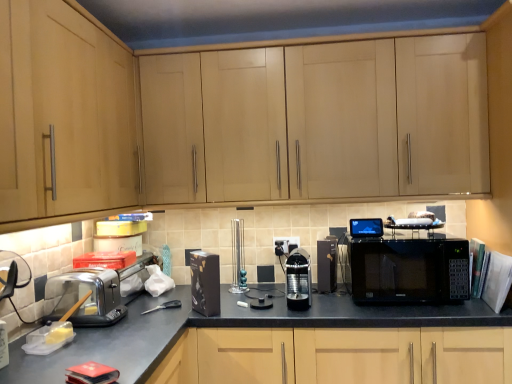
This screenshot has width=512, height=384. Describe the element at coordinates (327, 265) in the screenshot. I see `black plastic coffee machine at center, placed as the fourth appliance when sorted from left to right` at that location.

In order to face clear plastic toaster at lower left, should I rotate leftwards or rightwards?

Turn left approximately 21.924 degrees to face it.

What is the approximate width of sleek black coffee machine at center, which is the third appliance in left-to-right order?

It is 10.96 inches.

Describe the element at coordinates (298, 280) in the screenshot. This screenshot has height=384, width=512. I see `sleek black coffee machine at center, the 2th appliance positioned from the right` at that location.

Describe the element at coordinates (408, 270) in the screenshot. This screenshot has width=512, height=384. I see `black glossy microwave at center` at that location.

What are the coordinates of `light wood cabinet at upper center, acting as the first cabinetry starting from the back` in the screenshot? It's located at (318, 121).

How much space does black matte box at center, marked as the 1th appliance in a left-to-right arrangement, occupy horizontally?

The width of black matte box at center, marked as the 1th appliance in a left-to-right arrangement, is 16.67 centimeters.

You are a GUI agent. You are given a task and a screenshot of the screen. Output one action in this format:
    pyautogui.click(x=<x>, y=<y>)
    Task: Click on the black plastic electric outlet at center
    
    Given the screenshot: What is the action you would take?
    pyautogui.click(x=286, y=244)

This screenshot has height=384, width=512. In order to click on black plastic coffee machine at center, which appears as the 1th appliance when viewed from the right in this screenshot , I will do `click(327, 265)`.

Based on the photo, which object is positioned more to the left, light wood cabinet at left, which is the second cabinetry in back-to-front order, or black glossy microwave at center?

From the viewer's perspective, light wood cabinet at left, which is the second cabinetry in back-to-front order, appears more on the left side.

Which point is more distant from viewer, (56, 213) or (435, 270)?

The point (435, 270) is farther.

Based on the photo, between light wood cabinet at left, acting as the second cabinetry starting from the right, and black glossy microwave at center, which one has less height?

black glossy microwave at center.

From the image's perspective, is light wood cabinet at left, acting as the second cabinetry starting from the right, below black glossy microwave at center?

No, from the image's perspective, light wood cabinet at left, acting as the second cabinetry starting from the right, is not beneath black glossy microwave at center.

From a real-world perspective, between black plastic coffee machine at center, placed as the fourth appliance when sorted from left to right, and metallic teal candlesticks at center, positioned as the third appliance in right-to-left order, who is vertically higher?

metallic teal candlesticks at center, positioned as the third appliance in right-to-left order.

Is black plastic coffee machine at center, which appears as the 1th appliance when viewed from the right, not within metallic teal candlesticks at center, positioned as the third appliance in right-to-left order?

Absolutely, black plastic coffee machine at center, which appears as the 1th appliance when viewed from the right, is external to metallic teal candlesticks at center, positioned as the third appliance in right-to-left order.

Looking at their sizes, would you say black plastic coffee machine at center, placed as the fourth appliance when sorted from left to right, is wider or thinner than metallic teal candlesticks at center, positioned as the third appliance in right-to-left order?

black plastic coffee machine at center, placed as the fourth appliance when sorted from left to right, is wider than metallic teal candlesticks at center, positioned as the third appliance in right-to-left order.

Which of these two, black matte box at center, the fourth appliance from the right, or metallic teal candlesticks at center, positioned as the third appliance in right-to-left order, is smaller?

metallic teal candlesticks at center, positioned as the third appliance in right-to-left order.

Based on the photo, from the image's perspective, which one is positioned higher, black matte box at center, marked as the 1th appliance in a left-to-right arrangement, or metallic teal candlesticks at center, positioned as the third appliance in right-to-left order?

metallic teal candlesticks at center, positioned as the third appliance in right-to-left order, from the image's perspective.

How many degrees apart are the facing directions of black matte box at center, the fourth appliance from the right, and metallic teal candlesticks at center, positioned as the third appliance in right-to-left order?

black matte box at center, the fourth appliance from the right, and metallic teal candlesticks at center, positioned as the third appliance in right-to-left order, are facing 39.8 degrees away from each other.

Considering the sizes of black matte box at center, the fourth appliance from the right, and metallic teal candlesticks at center, arranged as the 2th appliance when viewed from the left, in the image, is black matte box at center, the fourth appliance from the right, taller or shorter than metallic teal candlesticks at center, arranged as the 2th appliance when viewed from the left,?

Considering their sizes, black matte box at center, the fourth appliance from the right, has less height than metallic teal candlesticks at center, arranged as the 2th appliance when viewed from the left.

Does metallic teal candlesticks at center, arranged as the 2th appliance when viewed from the left, turn towards black glossy microwave at center?

No, metallic teal candlesticks at center, arranged as the 2th appliance when viewed from the left, does not turn towards black glossy microwave at center.

Does point (236, 258) appear closer or farther from the camera than point (424, 255)?

Point (236, 258) is positioned farther from the camera compared to point (424, 255).

Considering the sizes of objects metallic teal candlesticks at center, arranged as the 2th appliance when viewed from the left, and black glossy microwave at center in the image provided, who is taller, metallic teal candlesticks at center, arranged as the 2th appliance when viewed from the left, or black glossy microwave at center?

metallic teal candlesticks at center, arranged as the 2th appliance when viewed from the left, is taller.

How many degrees apart are the facing directions of metallic teal candlesticks at center, arranged as the 2th appliance when viewed from the left, and black glossy microwave at center?

metallic teal candlesticks at center, arranged as the 2th appliance when viewed from the left, and black glossy microwave at center are facing 0.00051 degrees away from each other.

Are black plastic electric outlet at center and clear plastic toaster at lower left located far from each other?

No, black plastic electric outlet at center is not far from clear plastic toaster at lower left.

Consider the image. From a real-world perspective, is black plastic electric outlet at center physically located above or below clear plastic toaster at lower left?

In terms of real-world spatial position, black plastic electric outlet at center is above clear plastic toaster at lower left.

Which point is more distant from viewer, (279,243) or (94,299)?

The point (279,243) is farther from the camera.

In the image, is clear plastic toaster at lower left positioned in front of or behind black plastic coffee machine at center, placed as the fourth appliance when sorted from left to right?

clear plastic toaster at lower left is in front of black plastic coffee machine at center, placed as the fourth appliance when sorted from left to right.

Based on the photo, which is closer to the camera, (x=84, y=276) or (x=323, y=268)?

The point (x=84, y=276) is closer.

From the image's perspective, which one is positioned lower, clear plastic toaster at lower left or black plastic coffee machine at center, placed as the fourth appliance when sorted from left to right?

From the image's view, clear plastic toaster at lower left is below.

Considering the positions of objects clear plastic toaster at lower left and black plastic coffee machine at center, placed as the fourth appliance when sorted from left to right, in the image provided, who is more to the left, clear plastic toaster at lower left or black plastic coffee machine at center, placed as the fourth appliance when sorted from left to right,?

clear plastic toaster at lower left is more to the left.

Considering the positions of objects metallic teal candlesticks at center, arranged as the 2th appliance when viewed from the left, and clear plastic toaster at lower left in the image provided, who is more to the right, metallic teal candlesticks at center, arranged as the 2th appliance when viewed from the left, or clear plastic toaster at lower left?

metallic teal candlesticks at center, arranged as the 2th appliance when viewed from the left, is more to the right.

Looking at this image, from the image's perspective, which one is positioned higher, metallic teal candlesticks at center, arranged as the 2th appliance when viewed from the left, or clear plastic toaster at lower left?

metallic teal candlesticks at center, arranged as the 2th appliance when viewed from the left, from the image's perspective.

Is metallic teal candlesticks at center, arranged as the 2th appliance when viewed from the left, facing away from clear plastic toaster at lower left?

No, clear plastic toaster at lower left is not at the back of metallic teal candlesticks at center, arranged as the 2th appliance when viewed from the left.

Relative to clear plastic toaster at lower left, is metallic teal candlesticks at center, positioned as the third appliance in right-to-left order, in front or behind?

Clearly, metallic teal candlesticks at center, positioned as the third appliance in right-to-left order, is behind clear plastic toaster at lower left.

I want to click on microwave oven below the light wood cabinet at left, the 1th cabinetry from the left (from the image's perspective), so click(408, 270).

Starting from the metallic teal candlesticks at center, arranged as the 2th appliance when viewed from the left, which appliance is the 1st one in front? Please provide its 2D coordinates.

[(327, 265)]

From the image, which object appears to be nearer to black matte countertop at center, metallic teal candlesticks at center, arranged as the 2th appliance when viewed from the left, or light wood cabinet at upper center, which appears as the 2th cabinetry when viewed from the left?

metallic teal candlesticks at center, arranged as the 2th appliance when viewed from the left, lies closer to black matte countertop at center than the other object.

Based on their spatial positions, is light wood cabinet at upper center, acting as the first cabinetry starting from the back, or black matte countertop at center closer to metallic teal candlesticks at center, arranged as the 2th appliance when viewed from the left?

Among the two, black matte countertop at center is located nearer to metallic teal candlesticks at center, arranged as the 2th appliance when viewed from the left.

Estimate the real-world distances between objects in this image. Which object is further from sleek black coffee machine at center, which is the third appliance in left-to-right order, black plastic electric outlet at center or black matte box at center, marked as the 1th appliance in a left-to-right arrangement?

black matte box at center, marked as the 1th appliance in a left-to-right arrangement, is further to sleek black coffee machine at center, which is the third appliance in left-to-right order.

Consider the image. Estimate the real-world distances between objects in this image. Which object is further from sleek black coffee machine at center, the 2th appliance positioned from the right, black matte box at center, marked as the 1th appliance in a left-to-right arrangement, or black plastic coffee machine at center, placed as the fourth appliance when sorted from left to right?

Based on the image, black matte box at center, marked as the 1th appliance in a left-to-right arrangement, appears to be further to sleek black coffee machine at center, the 2th appliance positioned from the right.

From the image, which object appears to be farther from light wood cabinet at upper center, which is counted as the 1th cabinetry, starting from the right, metallic teal candlesticks at center, arranged as the 2th appliance when viewed from the left, or light wood cabinet at left, which is the 1th cabinetry from front to back?

metallic teal candlesticks at center, arranged as the 2th appliance when viewed from the left, lies further to light wood cabinet at upper center, which is counted as the 1th cabinetry, starting from the right, than the other object.

From the image, which object appears to be farther from black plastic coffee machine at center, placed as the fourth appliance when sorted from left to right, black plastic electric outlet at center or black glossy microwave at center?

Among the two, black glossy microwave at center is located further to black plastic coffee machine at center, placed as the fourth appliance when sorted from left to right.

When comparing their distances from light wood cabinet at upper center, which appears as the 2th cabinetry when viewed from the left, does black matte countertop at center or black plastic electric outlet at center seem further?

Based on the image, black matte countertop at center appears to be further to light wood cabinet at upper center, which appears as the 2th cabinetry when viewed from the left.

Consider the image. From the image, which object appears to be farther from clear plastic toaster at lower left, light wood cabinet at left, the 1th cabinetry from the left, or metallic teal candlesticks at center, positioned as the third appliance in right-to-left order?

metallic teal candlesticks at center, positioned as the third appliance in right-to-left order, lies further to clear plastic toaster at lower left than the other object.

The height and width of the screenshot is (384, 512). I want to click on cabinetry between clear plastic toaster at lower left and black glossy microwave at center in the horizontal direction, so click(x=318, y=121).

The height and width of the screenshot is (384, 512). Identify the location of toaster between light wood cabinet at left, acting as the second cabinetry starting from the right, and black matte countertop at center, in the horizontal direction. (88, 297).

Identify the location of electric outlet between light wood cabinet at left, which is the 1th cabinetry from front to back, and black glossy microwave at center from left to right. (286, 244).

At what (x,y) coordinates should I click in order to perform the action: click on countertop situated between sleek black coffee machine at center, the 2th appliance positioned from the right, and black glossy microwave at center from left to right. Please return your answer as a coordinate pair (x, y). The height and width of the screenshot is (384, 512). Looking at the image, I should click on (248, 326).